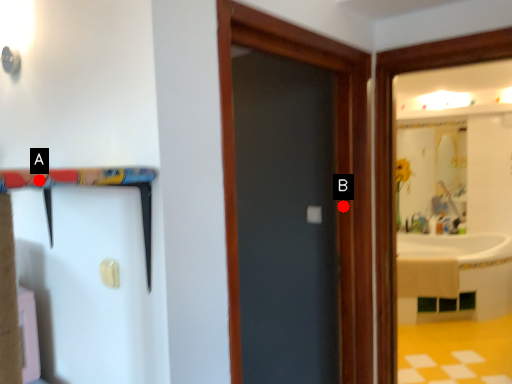
Question: Two points are circled on the image, labeled by A and B beside each circle. Which point is farther to the camera?

Choices:
 (A) A is further
 (B) B is further

Answer: (B)